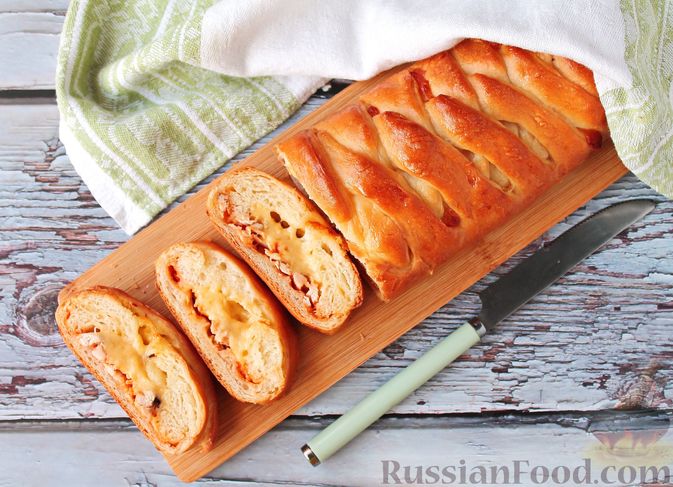
The width and height of the screenshot is (673, 487). What are the coordinates of `table` in the screenshot? It's located at (36, 64).